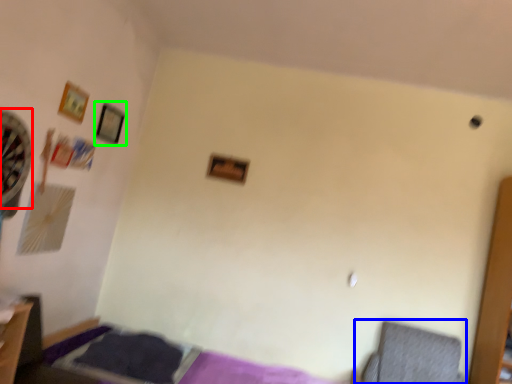
Question: Which object is the farthest from fan (highlighted by a red box)? Choose among these: swivel chair (highlighted by a blue box) or picture frame (highlighted by a green box).

Choices:
 (A) swivel chair
 (B) picture frame

Answer: (A)